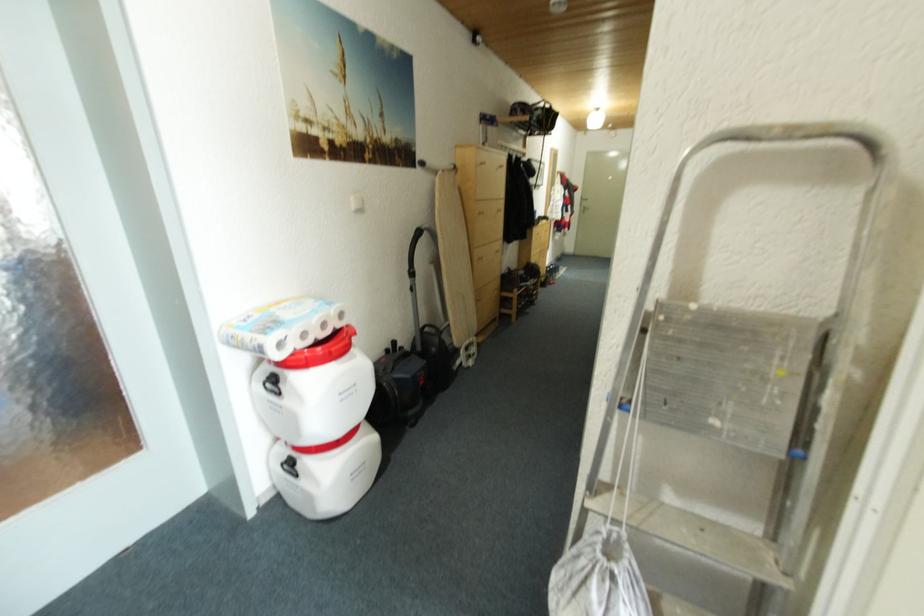
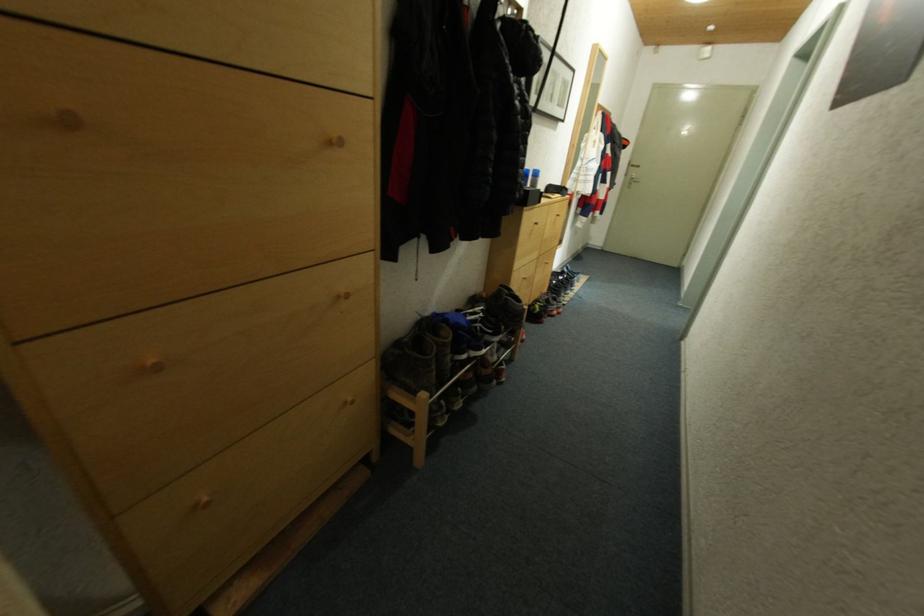
Question: What movement of the cameraman would produce the second image?

Choices:
 (A) Left
 (B) Right
 (C) Forward
 (D) Backward

Answer: (C)